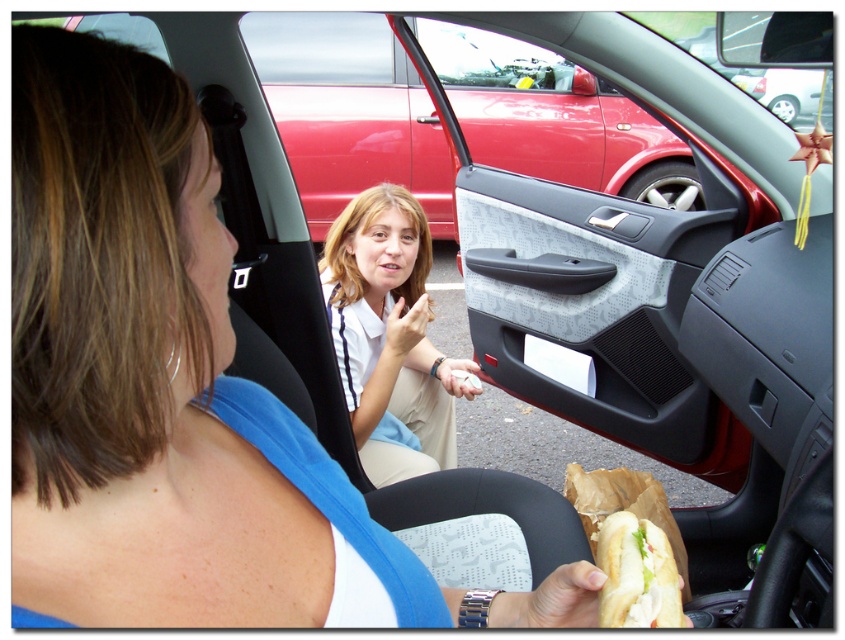
Question: Which point is closer to the camera?

Choices:
 (A) (346, 288)
 (B) (620, 605)

Answer: (B)

Question: Is light brown fabric shirt at center above white bread sandwich at lower right?

Choices:
 (A) yes
 (B) no

Answer: (A)

Question: Does light brown fabric shirt at center appear on the right side of white bread sandwich at lower right?

Choices:
 (A) no
 (B) yes

Answer: (A)

Question: Does light brown fabric shirt at center appear over white bread sandwich at lower right?

Choices:
 (A) no
 (B) yes

Answer: (B)